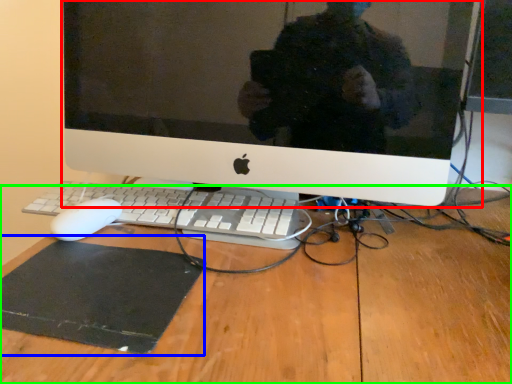
Question: Which is nearer to the computer monitor (highlighted by a red box)? mousepad (highlighted by a blue box) or desk (highlighted by a green box).

Choices:
 (A) mousepad
 (B) desk

Answer: (B)